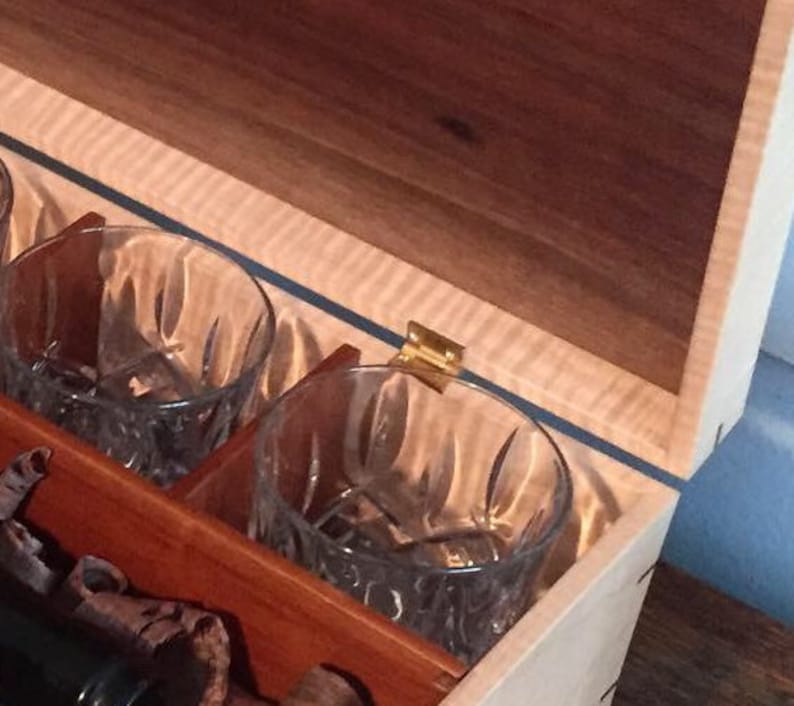
The width and height of the screenshot is (794, 706). Find the location of `box`. box is located at coordinates (575, 656).